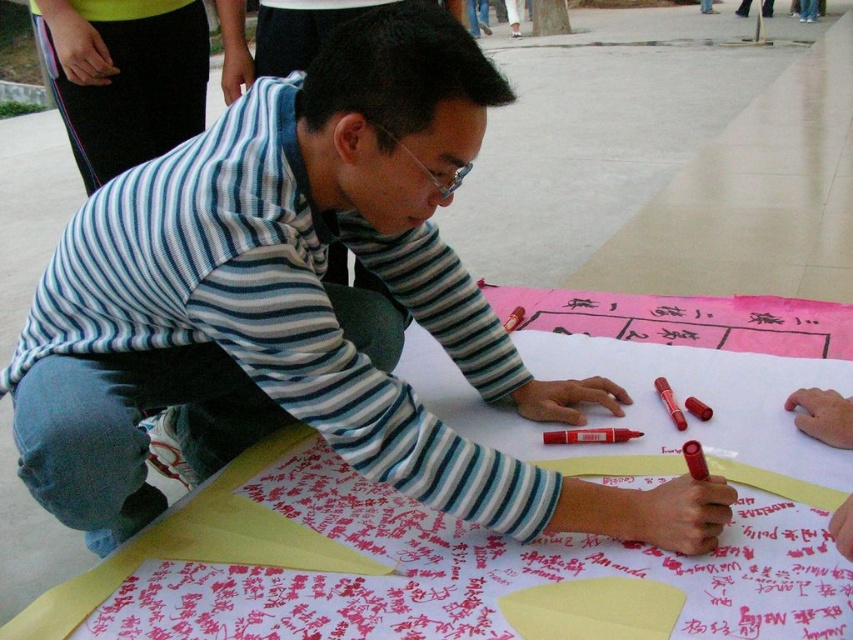
Question: Is red matte marker at center smaller than matte red marker at center?

Choices:
 (A) yes
 (B) no

Answer: (A)

Question: Does red matte marker at center appear over matte red marker at center?

Choices:
 (A) yes
 (B) no

Answer: (B)

Question: Which object appears farthest from the camera in this image?

Choices:
 (A) matte red marker at center
 (B) red matte marker at center

Answer: (A)

Question: Can you confirm if red matte marker at center is bigger than matte red marker at center?

Choices:
 (A) no
 (B) yes

Answer: (A)